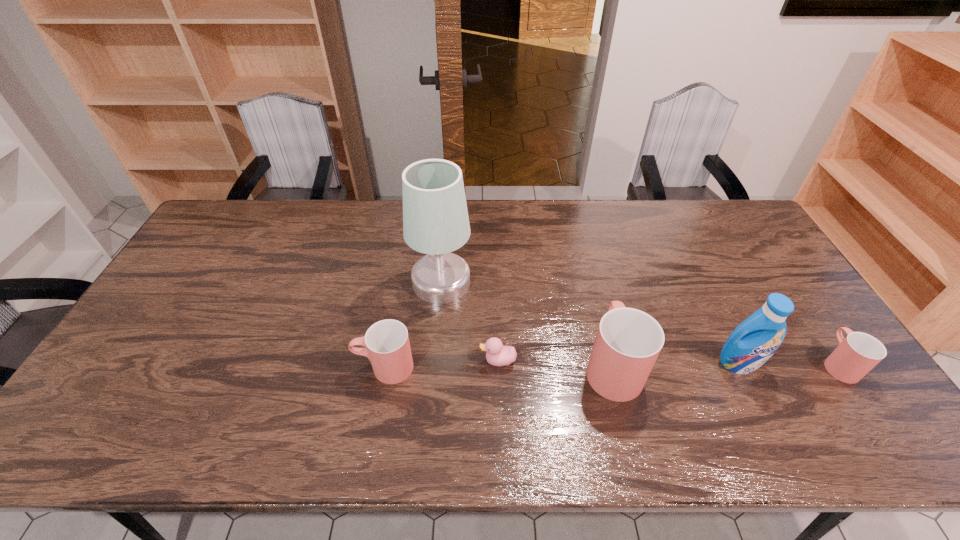
Where is `free point that keeps the cups evenly spaced on the left`? free point that keeps the cups evenly spaced on the left is located at coordinates tap(156, 369).